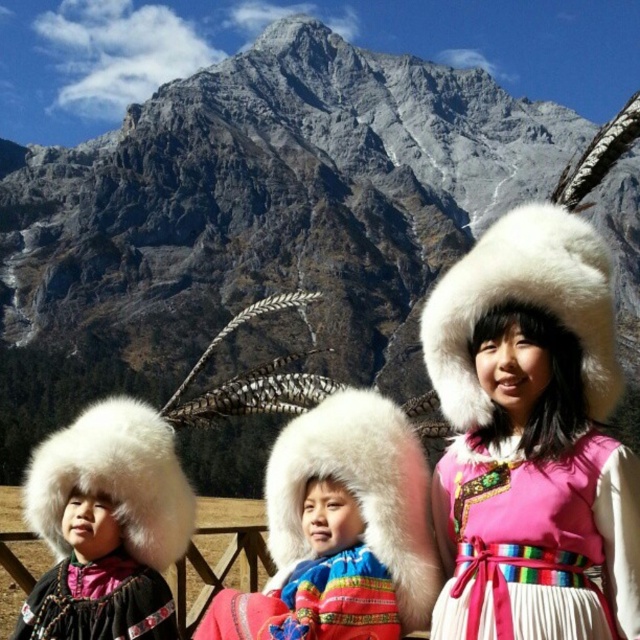
Question: Which of these objects is positioned farthest from the white fur headdress at upper right?

Choices:
 (A) white fur hat at center
 (B) pink satin dress at center

Answer: (A)

Question: Considering the relative positions of white fur hat at center and pink satin dress at center in the image provided, where is white fur hat at center located with respect to pink satin dress at center?

Choices:
 (A) below
 (B) above

Answer: (A)

Question: Which point is closer to the camera taking this photo?

Choices:
 (A) (332, 608)
 (B) (481, 636)
 (C) (410, 234)

Answer: (B)

Question: Does white fur hat at center appear on the right side of white fur hat at left?

Choices:
 (A) no
 (B) yes

Answer: (B)

Question: Can you confirm if pink satin dress at center is wider than white fur hat at left?

Choices:
 (A) no
 (B) yes

Answer: (A)

Question: Among these objects, which one is farthest from the camera?

Choices:
 (A) white fur headdress at upper right
 (B) pink satin dress at center
 (C) black velvet dress at lower left

Answer: (C)